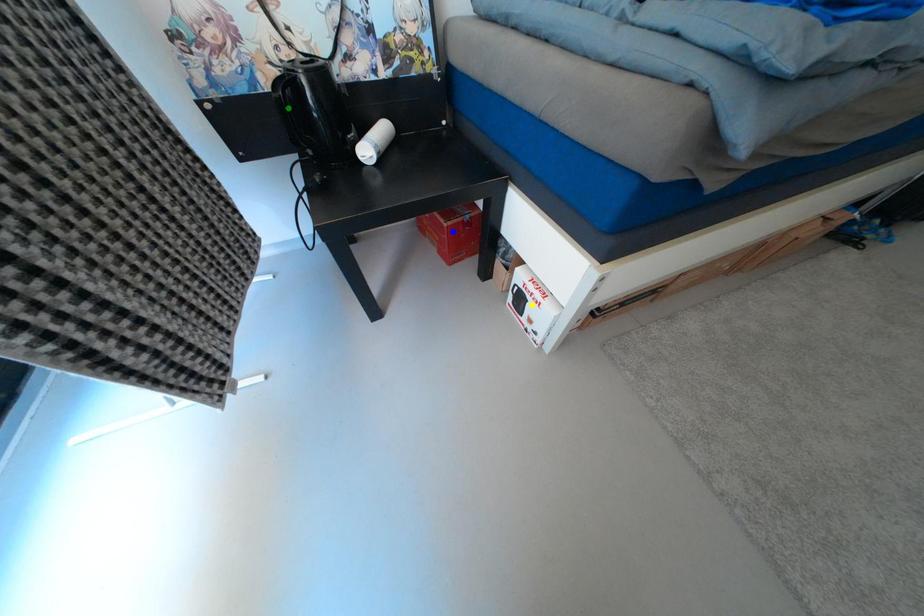
Order these from nearest to farthest:
green point, blue point, yellow point

green point → yellow point → blue point